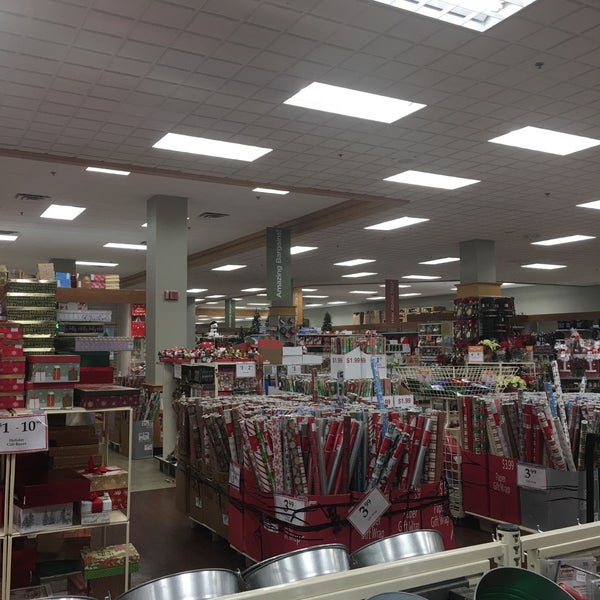
You are a GUI agent. You are given a task and a screenshot of the screen. Output one action in this format:
    pyautogui.click(x=<x>, y=<y>)
    Task: Click on the corner
    
    Given the screenshot: What is the action you would take?
    pyautogui.click(x=554, y=284)